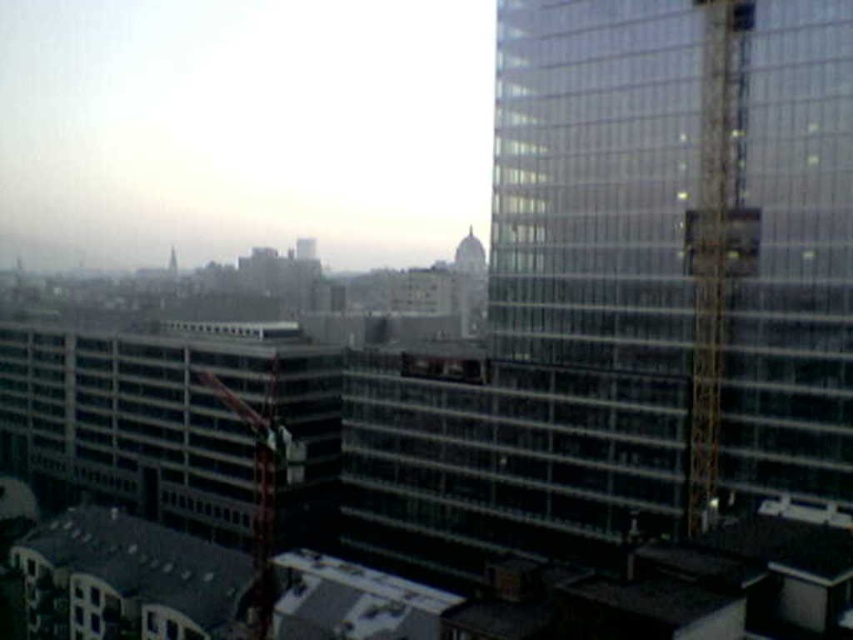
What do you see at coordinates (712, 243) in the screenshot? I see `gold/yellow metal crane at right` at bounding box center [712, 243].

Locate an element on the screen. The height and width of the screenshot is (640, 853). gold/yellow metal crane at right is located at coordinates (712, 243).

Can you confirm if transparent glass tower at right is shorter than metallic red crane at center-left?

No.

From the picture: Between transparent glass tower at right and metallic red crane at center-left, which one appears on the right side from the viewer's perspective?

transparent glass tower at right is more to the right.

Is point (753, 173) positioned in front of point (260, 577)?

No, (753, 173) is behind (260, 577).

Identify the location of transparent glass tower at right. The height and width of the screenshot is (640, 853). (683, 225).

Is point (787, 156) positioned before point (709, 378)?

Yes.

Between transparent glass tower at right and gold/yellow metal crane at right, which one appears on the right side from the viewer's perspective?

Positioned to the right is gold/yellow metal crane at right.

What are the coordinates of `transparent glass tower at right` in the screenshot? It's located at (683, 225).

Identify the location of transparent glass tower at right. The width and height of the screenshot is (853, 640). (683, 225).